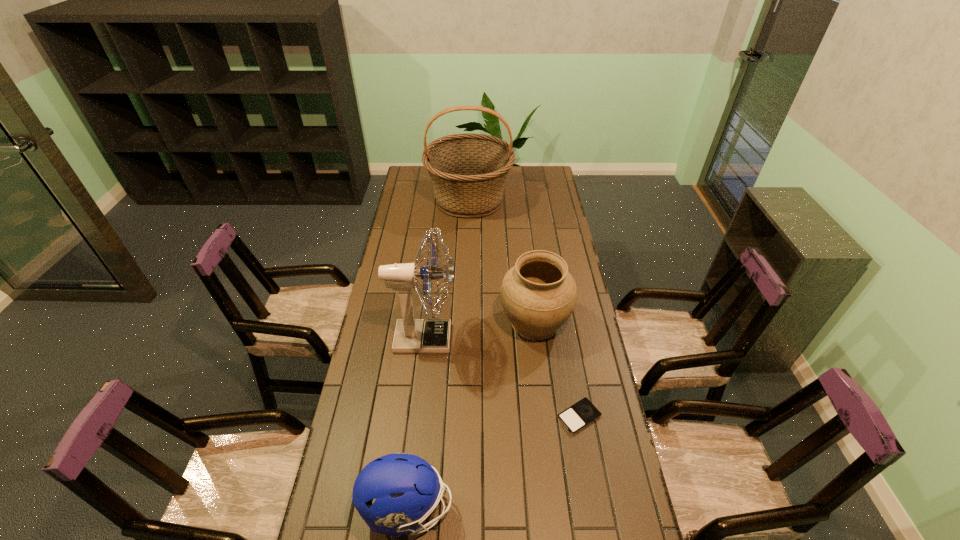
Where is `basket`? The width and height of the screenshot is (960, 540). basket is located at coordinates (468, 171).

Locate an element on the screen. fan is located at coordinates (412, 335).

Find the location of a particular element. The width and height of the screenshot is (960, 540). urn is located at coordinates (538, 294).

Find the location of `the second nearest object`. the second nearest object is located at coordinates (579, 415).

Where is `iPod`? The height and width of the screenshot is (540, 960). iPod is located at coordinates (579, 415).

Identify the location of free location located on the front of the basket. The height and width of the screenshot is (540, 960). (468, 265).

Where is `blank space located 0.380m on the front-facing side of the fan`? The image size is (960, 540). blank space located 0.380m on the front-facing side of the fan is located at coordinates (563, 338).

Where is `free space located 0.330m on the front of the third tallest object`? free space located 0.330m on the front of the third tallest object is located at coordinates (549, 441).

The image size is (960, 540). Find the location of `vacant space located on the left of the second nearest object`. vacant space located on the left of the second nearest object is located at coordinates (531, 417).

The image size is (960, 540). What are the coordinates of `object that is at the far edge` in the screenshot? It's located at (468, 171).